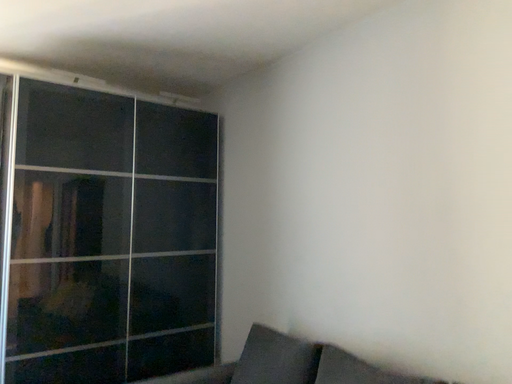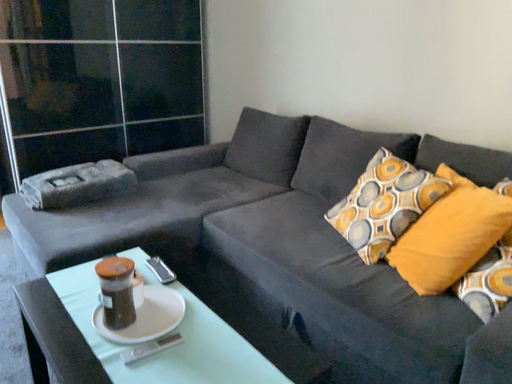
Question: How did the camera likely rotate when shooting the video?

Choices:
 (A) rotated upward
 (B) rotated downward

Answer: (B)